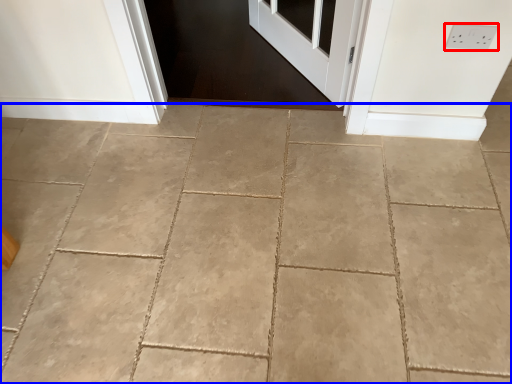
Question: Which object is closer to the camera taking this photo, electric outlet (highlighted by a red box) or concrete (highlighted by a blue box)?

Choices:
 (A) electric outlet
 (B) concrete

Answer: (B)